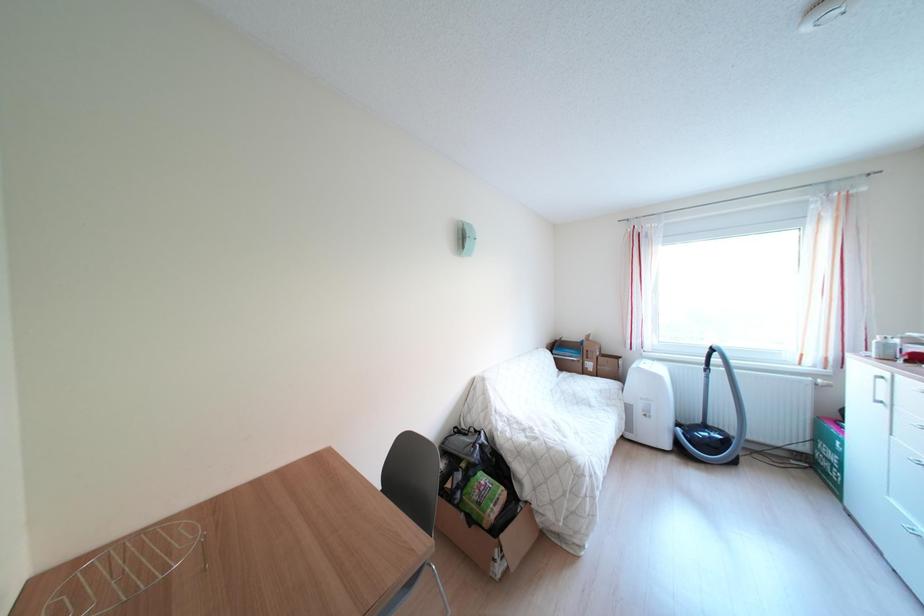
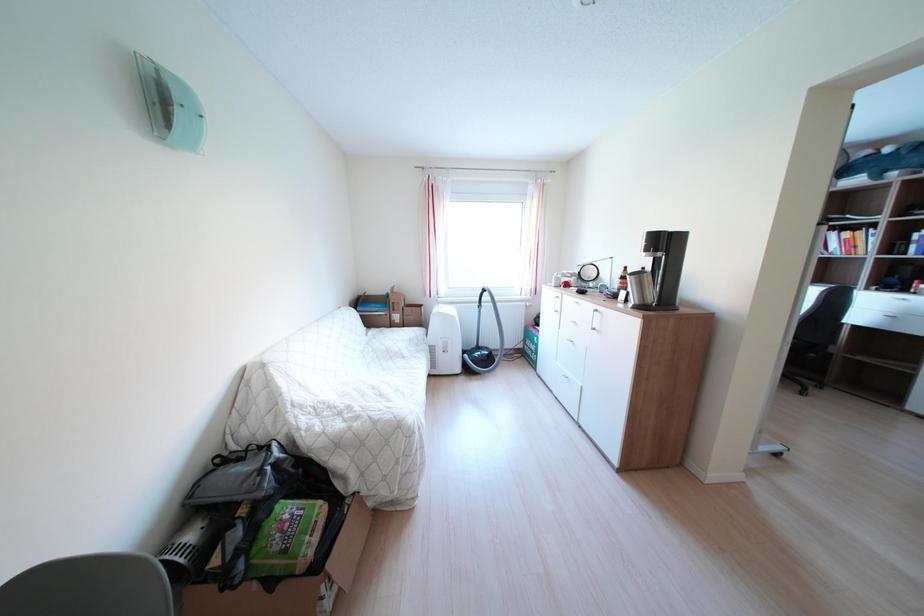
Question: The first image is from the beginning of the video and the second image is from the end. How did the camera likely rotate when shooting the video?

Choices:
 (A) Left
 (B) Right
 (C) Up
 (D) Down

Answer: (B)